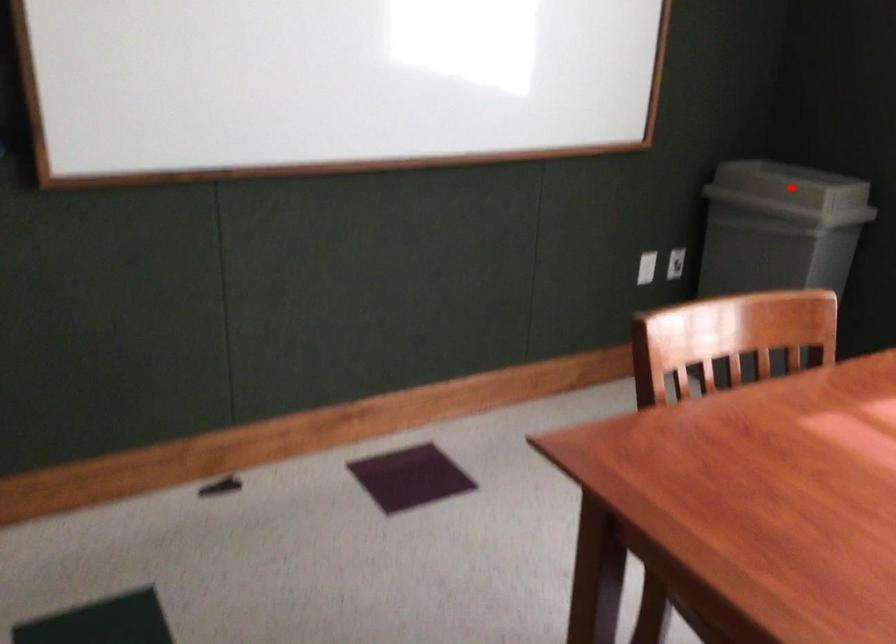
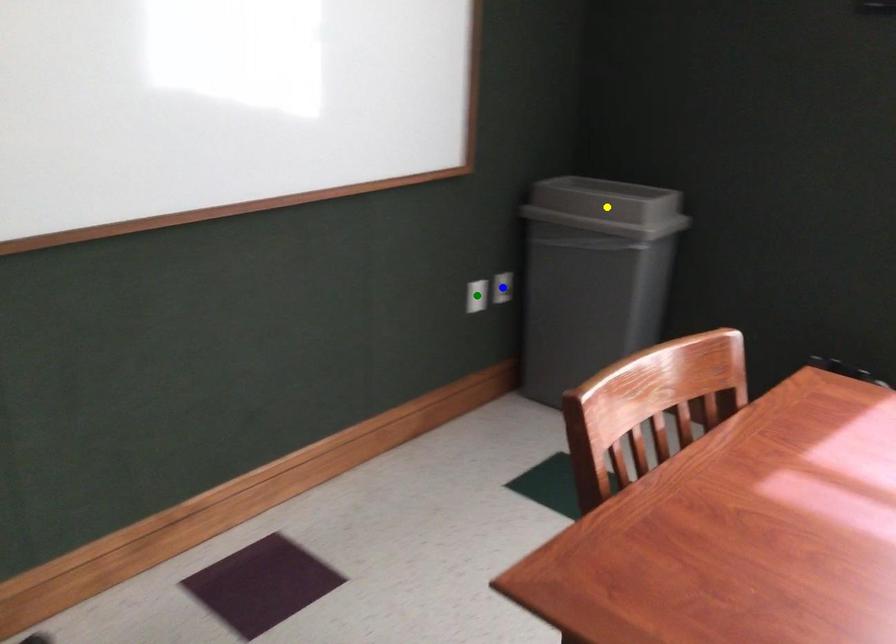
Question: I am providing you with two images of the same scene from different viewpoints. A red point is marked on the first image. You are given multiple points on the second image. In image 2, which mark is for the same physical point as the one in image 1?

Choices:
 (A) blue point
 (B) yellow point
 (C) green point

Answer: (B)